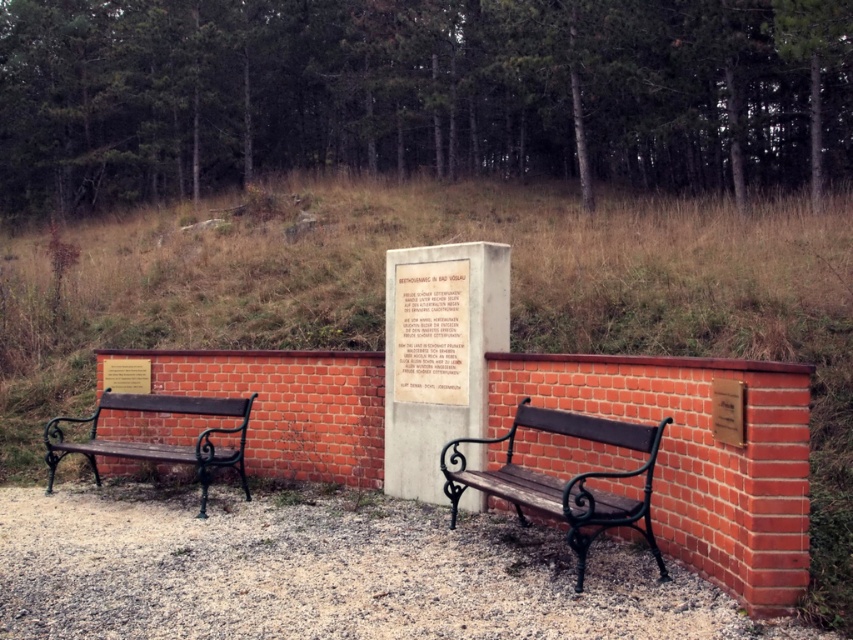
Question: Is wooden bench at center below dark brown wood bench at left?

Choices:
 (A) no
 (B) yes

Answer: (A)

Question: Is wooden bench at center thinner than dark brown wood bench at left?

Choices:
 (A) no
 (B) yes

Answer: (B)

Question: Does wooden bench at center have a smaller size compared to dark brown wood bench at left?

Choices:
 (A) yes
 (B) no

Answer: (A)

Question: Which object appears closest to the camera in this image?

Choices:
 (A) wooden bench at center
 (B) dark brown wood bench at left

Answer: (A)

Question: Among these points, which one is nearest to the camera?

Choices:
 (A) (595, 435)
 (B) (56, 458)

Answer: (A)